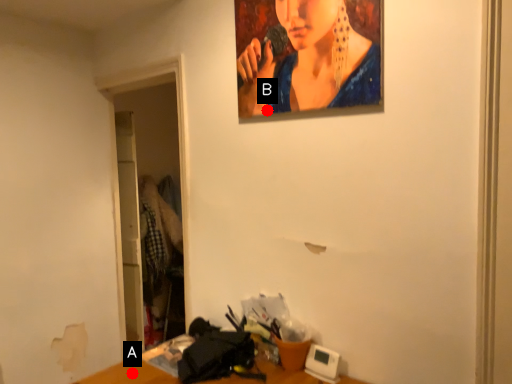
Question: Two points are circled on the image, labeled by A and B beside each circle. Among these points, which one is farthest from the camera?

Choices:
 (A) A is further
 (B) B is further

Answer: (B)